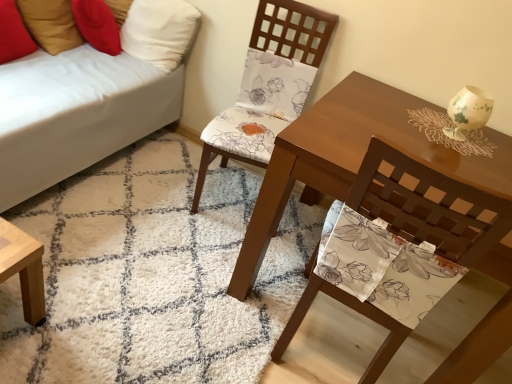
Question: Visually, is white shaggy rug at center positioned to the left or to the right of floral fabric chair at center, the 2th chair from the back?

Choices:
 (A) left
 (B) right

Answer: (A)

Question: From their relative heights in the image, would you say white shaggy rug at center is taller or shorter than floral fabric chair at center, positioned as the first chair in front-to-back order?

Choices:
 (A) short
 (B) tall

Answer: (A)

Question: Which is farther from the matte floral fabric chair at center, positioned as the 1th chair in back-to-front order?

Choices:
 (A) white shaggy rug at center
 (B) matte brown table at center
 (C) white fabric couch at lower left
 (D) white fabric pillow at upper left, which appears as the 2th pillow when viewed from the left
 (E) floral fabric chair at center, the 2th chair from the back

Answer: (E)

Question: Estimate the real-world distances between objects in this image. Which object is closer to the white fabric pillow at upper left, which is the first pillow in right-to-left order?

Choices:
 (A) floral fabric chair at center, the 2th chair from the back
 (B) matte floral fabric chair at center, positioned as the 1th chair in back-to-front order
 (C) matte brown table at center
 (D) white fabric couch at lower left
 (E) red fabric pillow at upper left, the 1th pillow when ordered from left to right

Answer: (D)